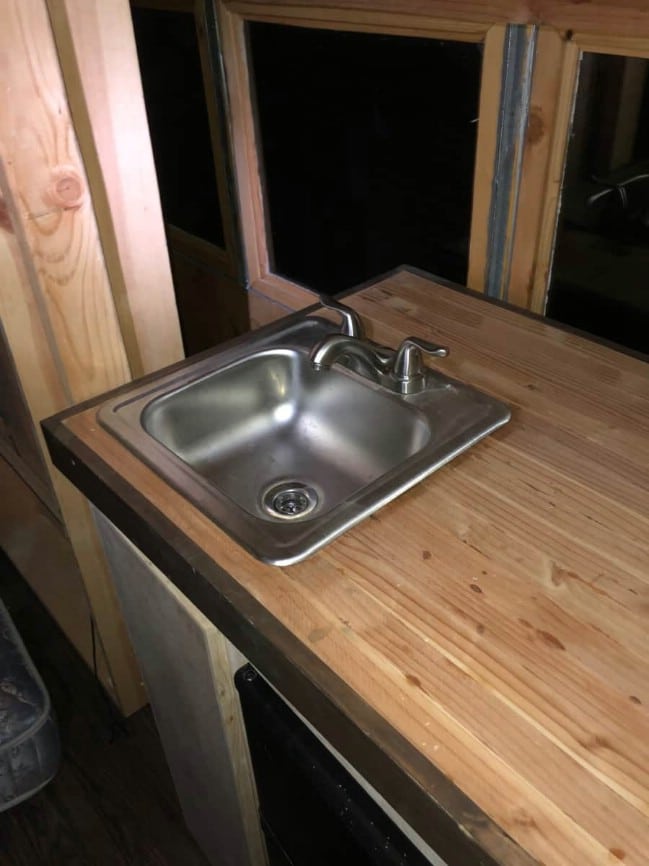
Image resolution: width=649 pixels, height=866 pixels. Find the location of `wood counter`. wood counter is located at coordinates (550, 671).